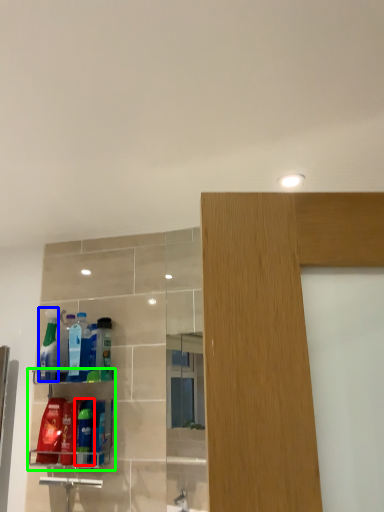
Question: Based on their relative distances, which object is farther from cleaning product (highlighted by a red box)? Choose from cleaning product (highlighted by a blue box) and shelf (highlighted by a green box).

Choices:
 (A) cleaning product
 (B) shelf

Answer: (A)